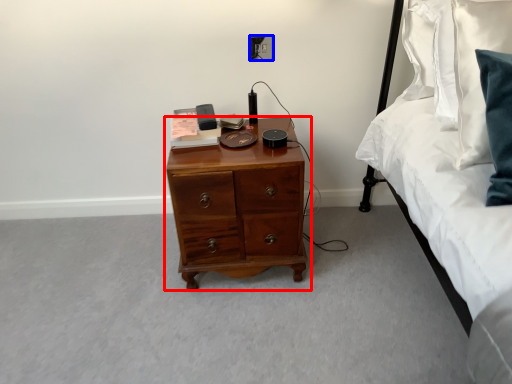
Question: Which of the following is the closest to the observer, chest of drawers (highlighted by a red box) or electric outlet (highlighted by a blue box)?

Choices:
 (A) chest of drawers
 (B) electric outlet

Answer: (A)